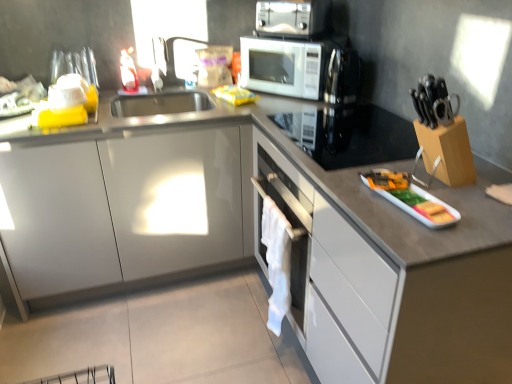
Question: From a real-world perspective, is white glossy tray at right, the 1th appliance viewed from the front, positioned under white glossy microwave at upper center based on gravity?

Choices:
 (A) yes
 (B) no

Answer: (A)

Question: Is white glossy tray at right, which appears as the 1th appliance when ordered from the bottom, closer to the viewer compared to white glossy microwave at upper center?

Choices:
 (A) no
 (B) yes

Answer: (B)

Question: Does white glossy tray at right, the 1th appliance viewed from the front, have a lesser height compared to white glossy microwave at upper center?

Choices:
 (A) yes
 (B) no

Answer: (A)

Question: Is white glossy tray at right, which appears as the 1th appliance when ordered from the bottom, oriented away from white glossy microwave at upper center?

Choices:
 (A) no
 (B) yes

Answer: (A)

Question: Are white glossy tray at right, which appears as the 1th appliance when ordered from the bottom, and white glossy microwave at upper center far apart?

Choices:
 (A) yes
 (B) no

Answer: (B)

Question: From a real-world perspective, is white glossy tray at right, marked as the second appliance in a back-to-front arrangement, positioned above or below yellow plastic bag at upper center?

Choices:
 (A) below
 (B) above

Answer: (A)

Question: Visually, is white glossy tray at right, which appears as the 1th appliance when ordered from the bottom, positioned to the left or to the right of yellow plastic bag at upper center?

Choices:
 (A) right
 (B) left

Answer: (A)

Question: Is white glossy tray at right, the second appliance in the top-to-bottom sequence, bigger or smaller than yellow plastic bag at upper center?

Choices:
 (A) big
 (B) small

Answer: (A)

Question: Is white glossy tray at right, the second appliance in the top-to-bottom sequence, in front of or behind yellow plastic bag at upper center in the image?

Choices:
 (A) behind
 (B) front

Answer: (B)

Question: From the image's perspective, relative to black glass cooktop at upper right, which is counted as the second appliance, starting from the bottom, is metallic silver toaster oven at upper center above or below?

Choices:
 (A) below
 (B) above

Answer: (B)

Question: Considering the positions of metallic silver toaster oven at upper center and black glass cooktop at upper right, which is counted as the second appliance, starting from the bottom, in the image, is metallic silver toaster oven at upper center wider or thinner than black glass cooktop at upper right, which is counted as the second appliance, starting from the bottom,?

Choices:
 (A) thin
 (B) wide

Answer: (A)

Question: From a real-world perspective, is metallic silver toaster oven at upper center physically located above or below black glass cooktop at upper right, which is counted as the second appliance, starting from the bottom?

Choices:
 (A) below
 (B) above

Answer: (B)

Question: Is point click(322, 21) positioned closer to the camera than point click(362, 158)?

Choices:
 (A) closer
 (B) farther

Answer: (B)

Question: From the image's perspective, relative to black glass cooktop at upper right, which is counted as the second appliance, starting from the bottom, is white fabric at center above or below?

Choices:
 (A) below
 (B) above

Answer: (A)

Question: Is white fabric at center bigger or smaller than black glass cooktop at upper right, the first appliance from the back?

Choices:
 (A) big
 (B) small

Answer: (B)